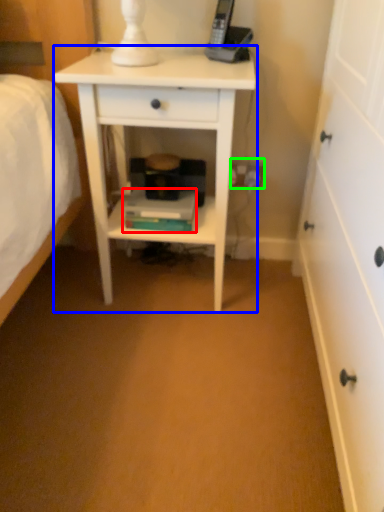
Question: Based on their relative distances, which object is nearer to book (highlighted by a red box)? Choose from nightstand (highlighted by a blue box) and electric outlet (highlighted by a green box).

Choices:
 (A) nightstand
 (B) electric outlet

Answer: (A)